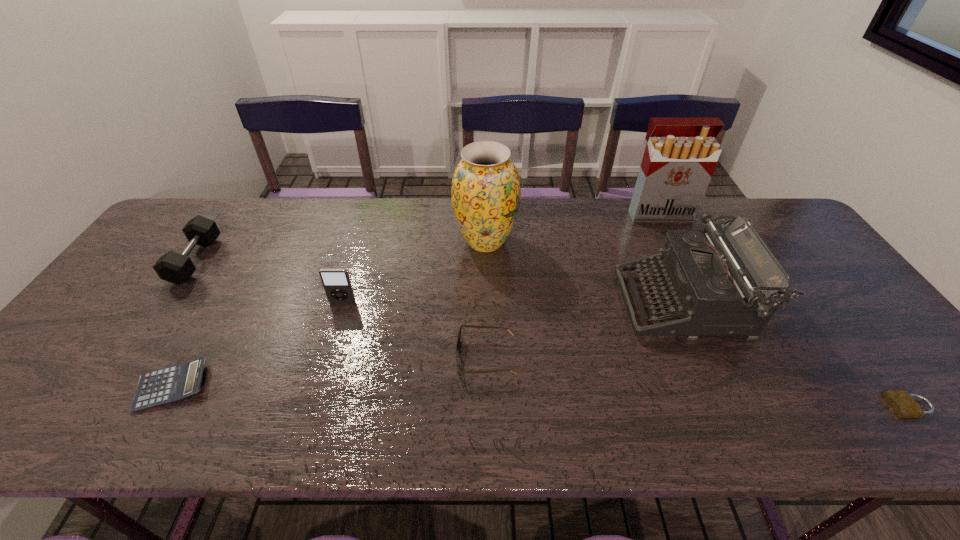
At what (x,y) coordinates should I click in order to perform the action: click on padlock. Please return your answer as a coordinate pair (x, y). Looking at the image, I should click on (903, 404).

This screenshot has height=540, width=960. I want to click on the shortest object, so click(903, 404).

This screenshot has width=960, height=540. I want to click on free space located with the lid open on the farthest object, so click(x=698, y=294).

At what (x,y) coordinates should I click in order to perform the action: click on free region located 0.400m on the left of the vase. Please return your answer as a coordinate pair (x, y). Looking at the image, I should click on (324, 242).

You are a GUI agent. You are given a task and a screenshot of the screen. Output one action in this format:
    pyautogui.click(x=<x>, y=<y>)
    Task: Click on the vacant region located on the typing side of the sixth shortest object
    
    Given the screenshot: What is the action you would take?
    pyautogui.click(x=513, y=304)

You are a GUI agent. You are given a task and a screenshot of the screen. Output one action in this format:
    pyautogui.click(x=<x>, y=<y>)
    Task: Click on the free space located 0.260m on the typing side of the sixth shortest object
    
    Given the screenshot: What is the action you would take?
    pyautogui.click(x=524, y=304)

Identify the location of vacant space located 0.070m on the typing side of the sixth shortest object. (596, 304).

At what (x,y) coordinates should I click in order to perform the action: click on free space located 0.310m on the front-facing side of the sixth object from right to left. Please return your answer as a coordinate pair (x, y). Image resolution: width=960 pixels, height=540 pixels. Looking at the image, I should click on (310, 409).

Where is `blank area located 0.120m on the left of the dumbbell`? This screenshot has width=960, height=540. blank area located 0.120m on the left of the dumbbell is located at coordinates (141, 261).

I want to click on vacant space located on the lenses of the sunglasses, so click(x=288, y=357).